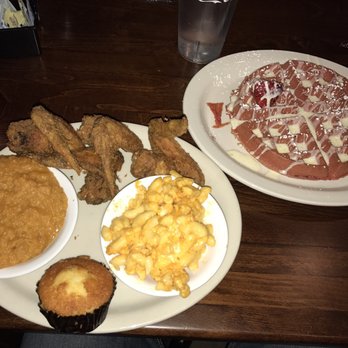
The height and width of the screenshot is (348, 348). In order to click on glass in this screenshot , I will do `click(198, 19)`.